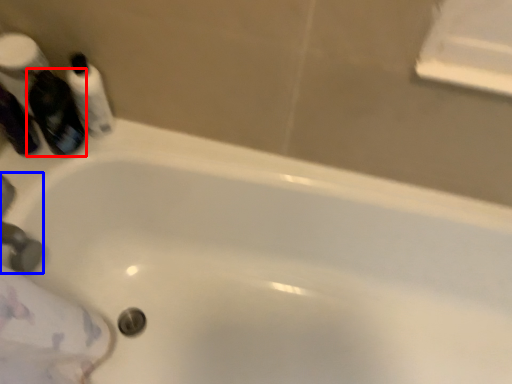
Question: Which of the following is the closest to the observer, mouthwash (highlighted by a red box) or faucet (highlighted by a blue box)?

Choices:
 (A) mouthwash
 (B) faucet

Answer: (B)